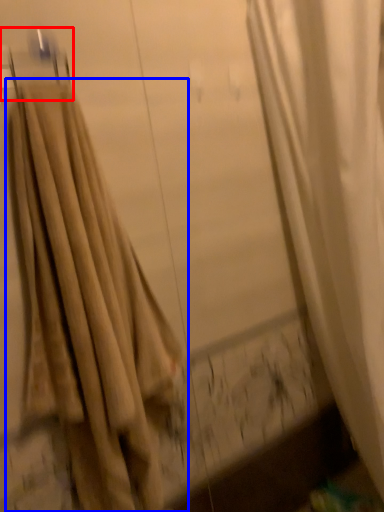
Question: Which of the following is the closest to the observer, hanger (highlighted by a red box) or curtain (highlighted by a blue box)?

Choices:
 (A) hanger
 (B) curtain

Answer: (B)